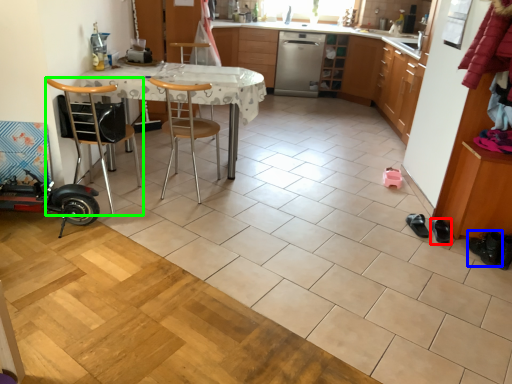
Question: Estimate the real-world distances between objects in this image. Which object is farther from footwear (highlighted by a red box), footwear (highlighted by a blue box) or chair (highlighted by a green box)?

Choices:
 (A) footwear
 (B) chair

Answer: (B)